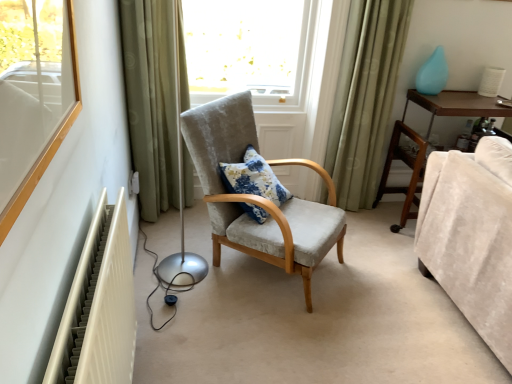
Question: Is teal glossy vase at upper right a part of white plastic electric outlet at lower left?

Choices:
 (A) no
 (B) yes

Answer: (A)

Question: Considering the relative sizes of white plastic electric outlet at lower left and teal glossy vase at upper right in the image provided, is white plastic electric outlet at lower left taller than teal glossy vase at upper right?

Choices:
 (A) yes
 (B) no

Answer: (B)

Question: Does white plastic electric outlet at lower left come in front of teal glossy vase at upper right?

Choices:
 (A) yes
 (B) no

Answer: (A)

Question: Is white plastic electric outlet at lower left not near teal glossy vase at upper right?

Choices:
 (A) yes
 (B) no

Answer: (A)

Question: Could you tell me if white plastic electric outlet at lower left is facing teal glossy vase at upper right?

Choices:
 (A) no
 (B) yes

Answer: (B)

Question: Is textured fabric armchair at center wider or thinner than velvet beige couch at lower right?

Choices:
 (A) wide
 (B) thin

Answer: (A)

Question: Considering their positions, is textured fabric armchair at center located in front of or behind velvet beige couch at lower right?

Choices:
 (A) front
 (B) behind

Answer: (B)

Question: Is textured fabric armchair at center taller or shorter than velvet beige couch at lower right?

Choices:
 (A) short
 (B) tall

Answer: (B)

Question: Based on their positions, is textured fabric armchair at center located to the left or right of velvet beige couch at lower right?

Choices:
 (A) right
 (B) left

Answer: (B)

Question: Which is correct: velvet beige couch at lower right is inside white plastic electric outlet at lower left, or outside of it?

Choices:
 (A) outside
 (B) inside

Answer: (A)

Question: Based on their sizes in the image, would you say velvet beige couch at lower right is bigger or smaller than white plastic electric outlet at lower left?

Choices:
 (A) big
 (B) small

Answer: (A)

Question: From a real-world perspective, is velvet beige couch at lower right above or below white plastic electric outlet at lower left?

Choices:
 (A) above
 (B) below

Answer: (A)

Question: Considering the positions of velvet beige couch at lower right and white plastic electric outlet at lower left in the image, is velvet beige couch at lower right taller or shorter than white plastic electric outlet at lower left?

Choices:
 (A) short
 (B) tall

Answer: (B)

Question: From the image's perspective, is brown wooden dresser at right positioned above or below green fabric curtain at left, the first curtain viewed from the left?

Choices:
 (A) above
 (B) below

Answer: (B)

Question: In terms of size, does brown wooden dresser at right appear bigger or smaller than green fabric curtain at left, the second curtain positioned from the right?

Choices:
 (A) big
 (B) small

Answer: (A)